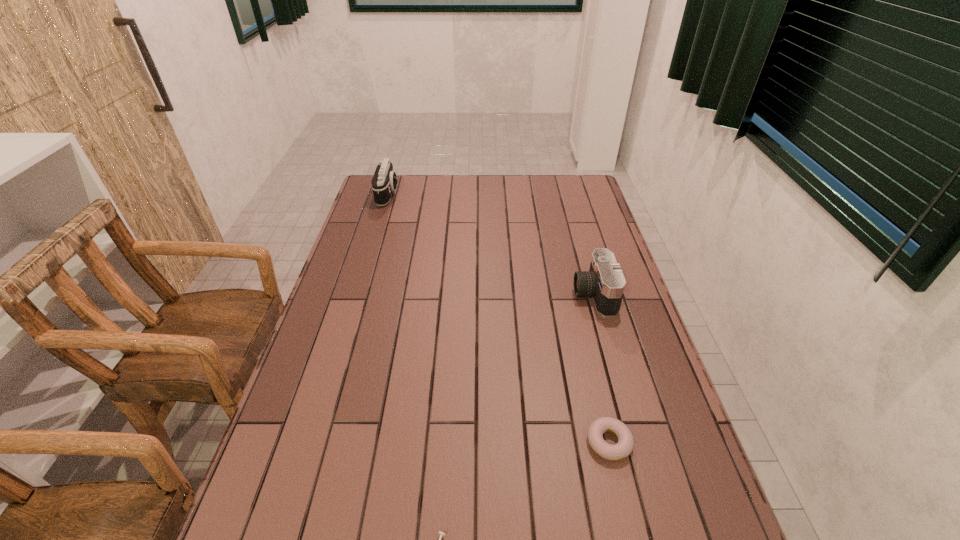
This screenshot has height=540, width=960. I want to click on vacant space that satisfies the following two spatial constraints: 1. on the back side of the doughnut; 2. on the front lens of the farthest object, so click(551, 194).